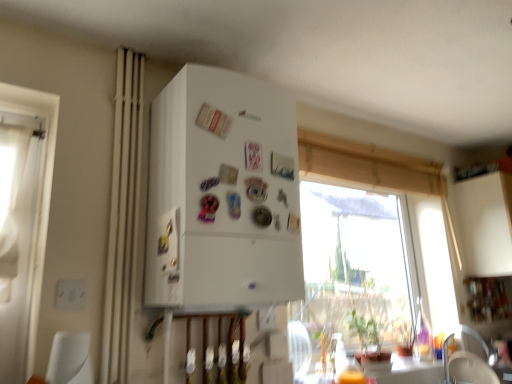
Identify the location of white fabric armchair at lower right. The image size is (512, 384). [x=469, y=370].

What do you see at coordinates (123, 217) in the screenshot? I see `beige fabric curtain at left` at bounding box center [123, 217].

Where is `white matte refrigerator at center`? Image resolution: width=512 pixels, height=384 pixels. white matte refrigerator at center is located at coordinates tap(222, 195).

The height and width of the screenshot is (384, 512). Find the location of `transparent glass window at upper center`. transparent glass window at upper center is located at coordinates (368, 166).

From a real-world perspective, is white fabric armchair at lower right physically below white matte refrigerator at center?

Yes, from a real-world perspective, white fabric armchair at lower right is under white matte refrigerator at center.

Between white fabric armchair at lower right and white matte refrigerator at center, which one is positioned in front?

white matte refrigerator at center.

Considering the relative sizes of white fabric armchair at lower right and white matte refrigerator at center in the image provided, is white fabric armchair at lower right wider than white matte refrigerator at center?

Incorrect, the width of white fabric armchair at lower right does not surpass that of white matte refrigerator at center.

Who is bigger, white fabric armchair at lower right or white matte refrigerator at center?

Bigger between the two is white matte refrigerator at center.

From a real-world perspective, is transparent glass window at upper center positioned over white fabric armchair at lower right based on gravity?

Yes, from a real-world perspective, transparent glass window at upper center is over white fabric armchair at lower right

Looking at this image, measure the distance from transparent glass window at upper center to white fabric armchair at lower right.

transparent glass window at upper center and white fabric armchair at lower right are 36.40 inches apart.

Is transparent glass window at upper center beside white fabric armchair at lower right?

There is a gap between transparent glass window at upper center and white fabric armchair at lower right.

Is transparent glass window at upper center surrounding white fabric armchair at lower right?

Definitely not — white fabric armchair at lower right is not inside transparent glass window at upper center.

Which of these two, white matte refrigerator at center or white fabric armchair at lower right, is smaller?

With smaller size is white fabric armchair at lower right.

Looking at this image, between white matte refrigerator at center and white fabric armchair at lower right, which one appears on the left side from the viewer's perspective?

white matte refrigerator at center is more to the left.

You are a GUI agent. You are given a task and a screenshot of the screen. Output one action in this format:
    pyautogui.click(x=<x>, y=<y>)
    Task: Click on the armchair behind the white matte refrigerator at center
    The image size is (512, 384).
    Given the screenshot: What is the action you would take?
    pyautogui.click(x=469, y=370)

From the image's perspective, does white matte refrigerator at center appear higher than white fabric armchair at lower right?

Correct, white matte refrigerator at center appears higher than white fabric armchair at lower right in the image.

Does white fabric armchair at lower right appear on the right side of transparent glass window at upper center?

Correct, you'll find white fabric armchair at lower right to the right of transparent glass window at upper center.

Is point (452, 371) farther from viewer compared to point (338, 170)?

That is True.

Where is `window in front of the white fabric armchair at lower right`? Image resolution: width=512 pixels, height=384 pixels. window in front of the white fabric armchair at lower right is located at coordinates (368, 166).

Visually, is transparent glass window at upper center positioned to the left or to the right of beige fabric curtain at left?

In the image, transparent glass window at upper center appears on the right side of beige fabric curtain at left.

Is transparent glass window at upper center thinner than beige fabric curtain at left?

Incorrect, the width of transparent glass window at upper center is not less than that of beige fabric curtain at left.

Does transparent glass window at upper center have a smaller size compared to beige fabric curtain at left?

Actually, transparent glass window at upper center might be larger than beige fabric curtain at left.

How many degrees apart are the facing directions of transparent glass window at upper center and beige fabric curtain at left?

The angle between the facing direction of transparent glass window at upper center and the facing direction of beige fabric curtain at left is 3.18 degrees.

From a real-world perspective, is beige fabric curtain at left below transparent glass window at upper center?

Yes, from a real-world perspective, beige fabric curtain at left is below transparent glass window at upper center.

Does beige fabric curtain at left turn towards transparent glass window at upper center?

No, beige fabric curtain at left is not aimed at transparent glass window at upper center.

Between point (120, 203) and point (401, 162), which one is positioned behind?

Point (401, 162)

Who is shorter, white matte refrigerator at center or transparent glass window at upper center?

Standing shorter between the two is transparent glass window at upper center.

How far apart are white matte refrigerator at center and transparent glass window at upper center?

white matte refrigerator at center and transparent glass window at upper center are 27.42 inches apart.

Find the location of `window located below the white matte refrigerator at center (from the image's perspective)`. window located below the white matte refrigerator at center (from the image's perspective) is located at coordinates click(368, 166).

From a real-world perspective, which is physically below, white matte refrigerator at center or transparent glass window at upper center?

In real-world perspective, white matte refrigerator at center is lower.

Where is `armchair behind the white matte refrigerator at center`? The height and width of the screenshot is (384, 512). armchair behind the white matte refrigerator at center is located at coordinates (469, 370).

At what (x,y) coordinates should I click in order to perform the action: click on window that is on the left side of white fabric armchair at lower right. Please return your answer as a coordinate pair (x, y). Looking at the image, I should click on (368, 166).

Considering their positions, is white fabric armchair at lower right positioned closer to beige fabric curtain at left than white matte refrigerator at center?

white matte refrigerator at center.

From the image, which object appears to be farther from white fabric armchair at lower right, transparent glass window at upper center or beige fabric curtain at left?

Among the two, beige fabric curtain at left is located further to white fabric armchair at lower right.

Estimate the real-world distances between objects in this image. Which object is closer to white fabric armchair at lower right, white matte refrigerator at center or beige fabric curtain at left?

white matte refrigerator at center lies closer to white fabric armchair at lower right than the other object.

Estimate the real-world distances between objects in this image. Which object is further from beige fabric curtain at left, white matte refrigerator at center or white fabric armchair at lower right?

Based on the image, white fabric armchair at lower right appears to be further to beige fabric curtain at left.

When comparing their distances from white fabric armchair at lower right, does transparent glass window at upper center or white matte refrigerator at center seem further?

white matte refrigerator at center is further to white fabric armchair at lower right.

Considering their positions, is transparent glass window at upper center positioned closer to beige fabric curtain at left than white matte refrigerator at center?

The object closer to beige fabric curtain at left is white matte refrigerator at center.

Considering their positions, is white fabric armchair at lower right positioned closer to transparent glass window at upper center than white matte refrigerator at center?

Among the two, white matte refrigerator at center is located nearer to transparent glass window at upper center.

Considering their positions, is beige fabric curtain at left positioned closer to transparent glass window at upper center than white fabric armchair at lower right?

white fabric armchair at lower right is positioned closer to the anchor transparent glass window at upper center.

Where is `window between white matte refrigerator at center and white fabric armchair at lower right`? This screenshot has height=384, width=512. window between white matte refrigerator at center and white fabric armchair at lower right is located at coordinates (368, 166).

What are the coordinates of `appliance between beige fabric curtain at left and transparent glass window at upper center from left to right` in the screenshot? It's located at (222, 195).

The width and height of the screenshot is (512, 384). In order to click on appliance between beige fabric curtain at left and white fabric armchair at lower right in the horizontal direction in this screenshot , I will do `click(222, 195)`.

Locate an element on the screen. window between beige fabric curtain at left and white fabric armchair at lower right is located at coordinates (368, 166).